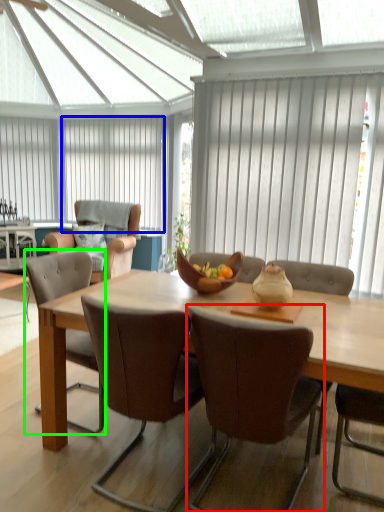
Question: Estimate the real-world distances between objects in this image. Which object is closer to chair (highlighted by a red box), curtain (highlighted by a blue box) or chair (highlighted by a green box)?

Choices:
 (A) curtain
 (B) chair

Answer: (B)